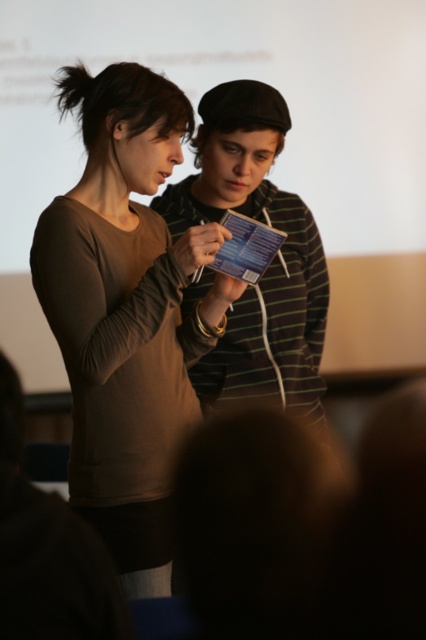
Does matte brown shirt at center appear on the left side of striped cotton sweater at center?

Yes, matte brown shirt at center is to the left of striped cotton sweater at center.

Locate an element on the screen. matte brown shirt at center is located at coordinates (126, 312).

What do you see at coordinates (126, 312) in the screenshot?
I see `matte brown shirt at center` at bounding box center [126, 312].

Find the location of a particular element. The width and height of the screenshot is (426, 640). matte brown shirt at center is located at coordinates (126, 312).